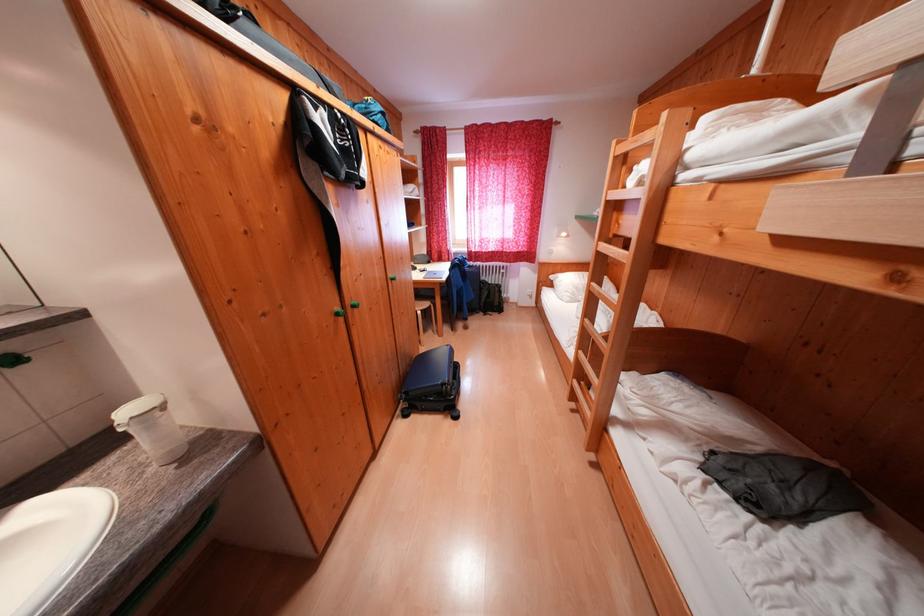
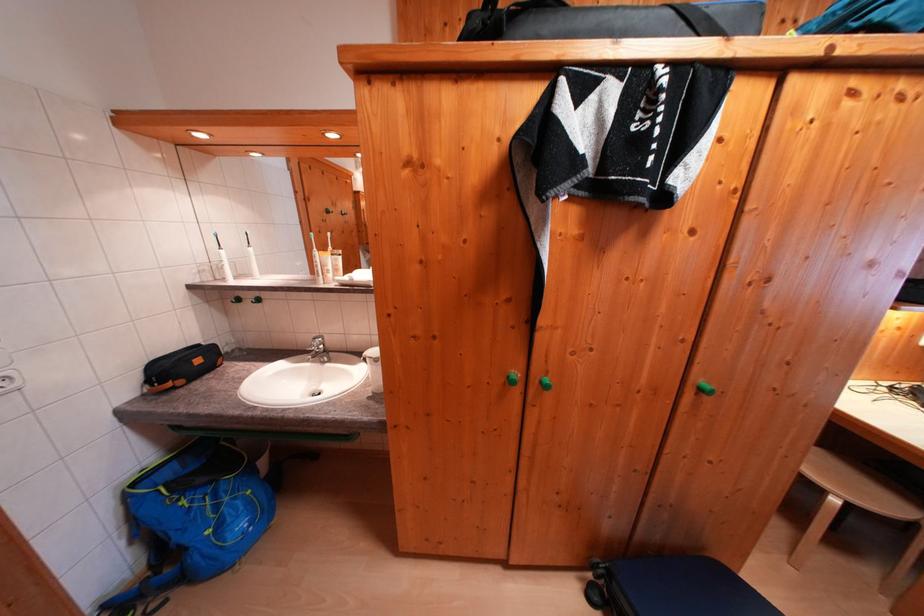
Locate, in the second image, the point that corresponds to the point at 361,310 in the first image.

(550, 387)